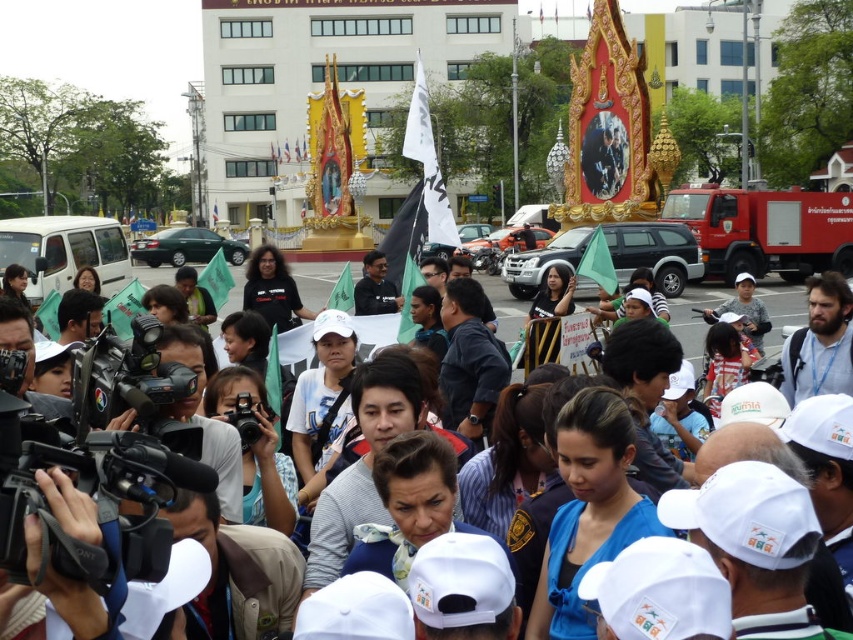
Question: Can you confirm if red matte fire truck at right is positioned to the left of white fabric flag at center?

Choices:
 (A) yes
 (B) no

Answer: (B)

Question: Does red matte fire truck at right appear under white fabric flag at center?

Choices:
 (A) no
 (B) yes

Answer: (A)

Question: Does red matte fire truck at right appear over white fabric flag at center?

Choices:
 (A) no
 (B) yes

Answer: (B)

Question: Which of the following is the farthest from the observer?

Choices:
 (A) 213,336
 (B) 837,208

Answer: (B)

Question: Which point appears farthest from the camera in this image?

Choices:
 (A) (758, 195)
 (B) (300, 273)

Answer: (B)